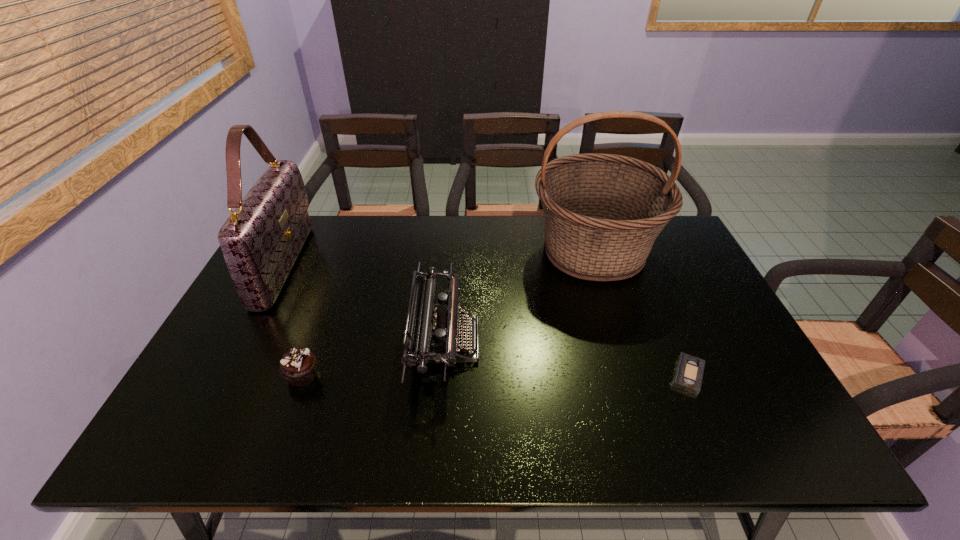
I want to click on vacant region between the handbag and the shortest object, so click(487, 320).

The height and width of the screenshot is (540, 960). I want to click on vacant region between the leftmost object and the cupcake, so click(x=294, y=320).

Locate an element on the screen. This screenshot has height=540, width=960. unoccupied position between the basket and the videotape is located at coordinates (641, 313).

Where is `object that is the third closest to the third object from left to right`? The image size is (960, 540). object that is the third closest to the third object from left to right is located at coordinates (260, 241).

The height and width of the screenshot is (540, 960). Identify the location of the third closest object relative to the shortest object. (298, 366).

This screenshot has height=540, width=960. What are the coordinates of `free location that satisfies the following two spatial constraints: 1. on the typing side of the shortest object; 2. on the left side of the third shortest object` in the screenshot? It's located at (443, 375).

Where is `vacant space that satisfies the following two spatial constraints: 1. on the back side of the shortest object; 2. on the front of the handbag with the clasp`? The image size is (960, 540). vacant space that satisfies the following two spatial constraints: 1. on the back side of the shortest object; 2. on the front of the handbag with the clasp is located at coordinates (641, 265).

Find the location of a particular element. vacant area that satisfies the following two spatial constraints: 1. on the typing side of the third shortest object; 2. on the back side of the shortest object is located at coordinates (443, 375).

The image size is (960, 540). I want to click on vacant position in the image that satisfies the following two spatial constraints: 1. on the typing side of the typewriter; 2. on the right side of the shortest object, so click(x=443, y=375).

Identify the location of free point that satisfies the following two spatial constraints: 1. on the back side of the cupcake; 2. on the front of the leftmost object with the clasp. Image resolution: width=960 pixels, height=540 pixels. (344, 265).